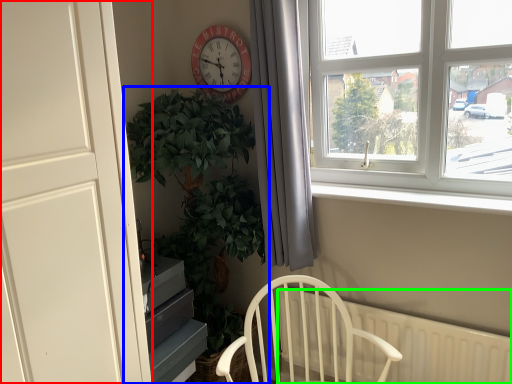
Question: Considering the real-world distances, which object is farthest from door (highlighted by a red box)? houseplant (highlighted by a blue box) or radiator (highlighted by a green box)?

Choices:
 (A) houseplant
 (B) radiator

Answer: (B)